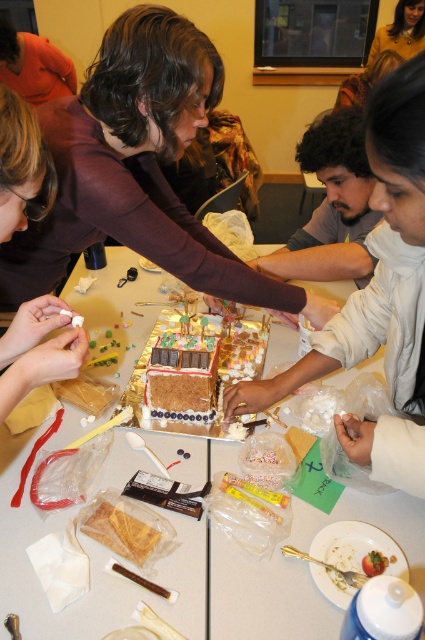
In the scene shown: You are a participant in the gingerbread house decorating activity and need to reach the white plastic table at center to grab some sprinkles. If your arm can extend 70 centimeters, can you reach the table without moving your position?

The white plastic table at center is 76.72 centimeters away from the camera, which is beyond the 70 centimeter reach of your arm. Therefore, you cannot reach the table without moving your position.